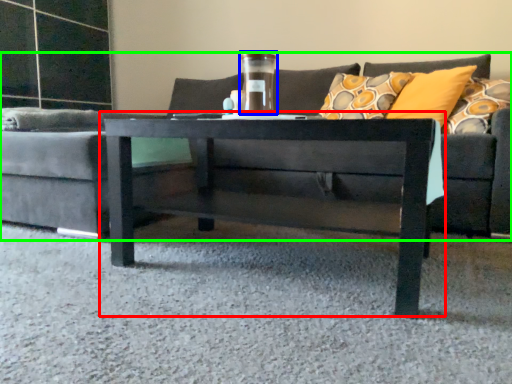
Question: Estimate the real-world distances between objects in this image. Which object is farther from coffee table (highlighted by a red box), glass vase (highlighted by a blue box) or studio couch (highlighted by a green box)?

Choices:
 (A) glass vase
 (B) studio couch

Answer: (B)